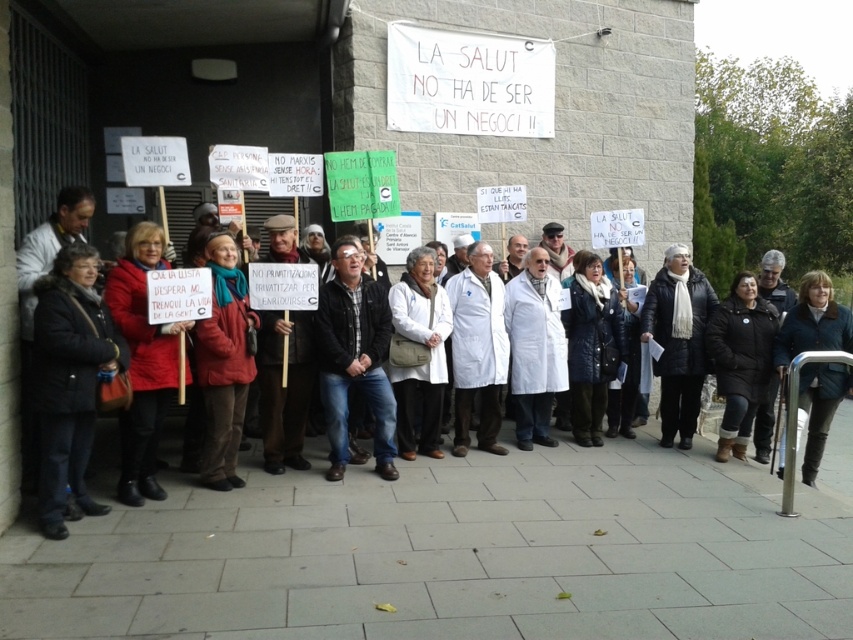
Question: Estimate the real-world distances between objects in this image. Which object is closer to the black leather jacket at left?

Choices:
 (A) black leather jacket at center
 (B) dark blue jeans at center

Answer: (B)

Question: Does dark blue jeans at center have a larger size compared to blue woolen jacket at center?

Choices:
 (A) no
 (B) yes

Answer: (A)

Question: Estimate the real-world distances between objects in this image. Which object is closer to the red wool coat at center?

Choices:
 (A) black leather jacket at center
 (B) black leather jacket at lower right

Answer: (A)

Question: Can you confirm if red wool coat at center is positioned to the right of black leather jacket at center?

Choices:
 (A) no
 (B) yes

Answer: (A)

Question: Estimate the real-world distances between objects in this image. Which object is closer to the black leather jacket at center?

Choices:
 (A) white lab coat at center
 (B) dark blue jeans at center
 (C) red wool coat at center

Answer: (A)

Question: Is black leather jacket at left further to the viewer compared to black leather jacket at center?

Choices:
 (A) yes
 (B) no

Answer: (B)